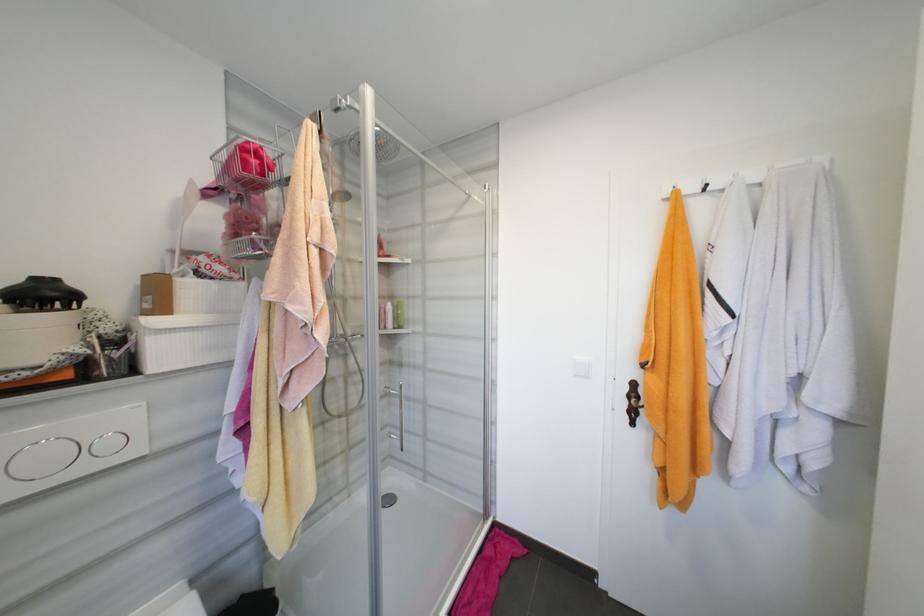
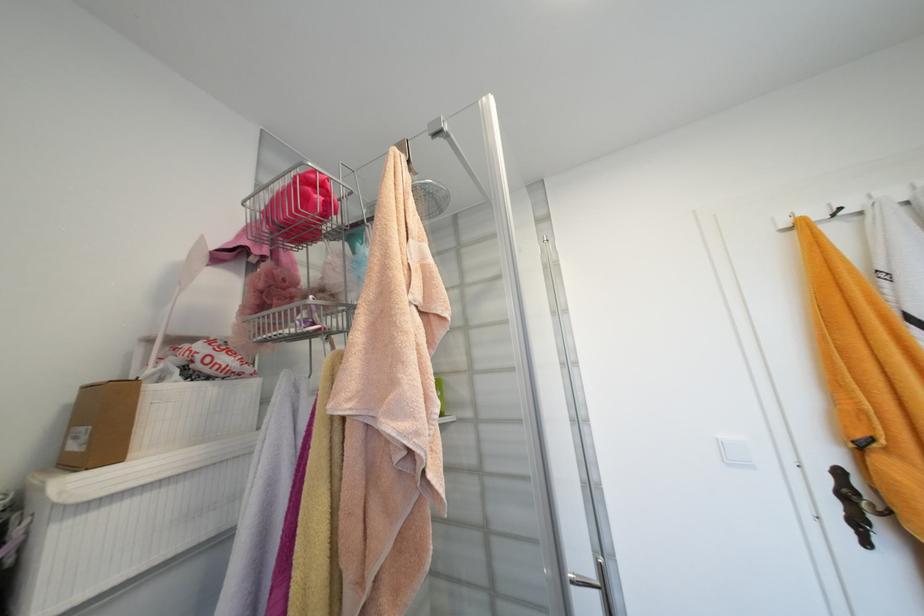
Locate, in the second image, the point that corresponds to the point at 177,253 in the first image.

(154, 342)